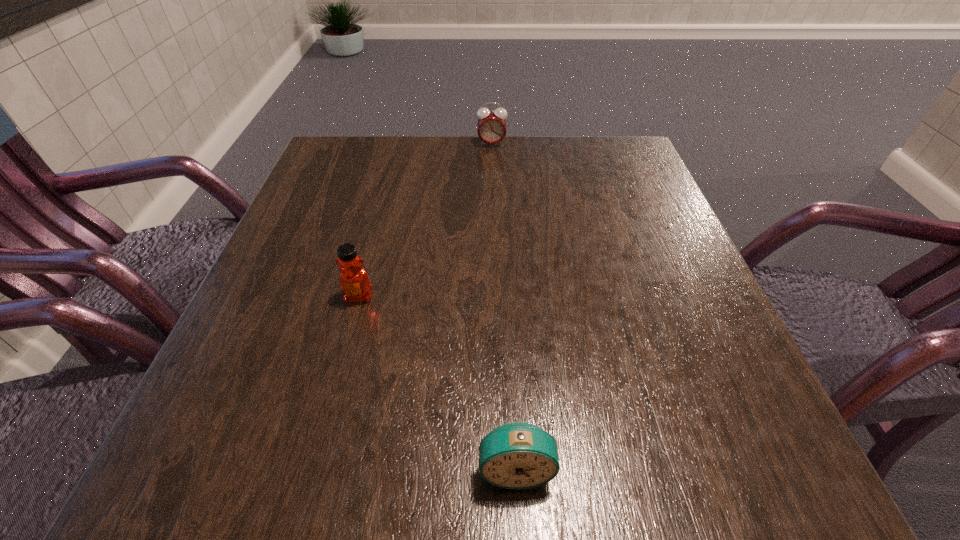
Identify the location of free space that is in between the nearest object and the farthest object. (504, 306).

I want to click on vacant area between the nearer alarm clock and the second nearest object, so click(x=438, y=382).

The width and height of the screenshot is (960, 540). In order to click on empty space that is in between the nearer alarm clock and the farthest object in this screenshot , I will do `click(504, 306)`.

Locate an element on the screen. free space between the leftmost object and the nearer alarm clock is located at coordinates (438, 382).

Identify which object is the closest to the nearer alarm clock. Please provide its 2D coordinates. Your answer should be formatted as a tuple, i.e. [(x, y)], where the tuple contains the x and y coordinates of a point satisfying the conditions above.

[(354, 281)]

Locate which object ranks second in proximity to the nearer alarm clock. Please provide its 2D coordinates. Your answer should be formatted as a tuple, i.e. [(x, y)], where the tuple contains the x and y coordinates of a point satisfying the conditions above.

[(491, 125)]